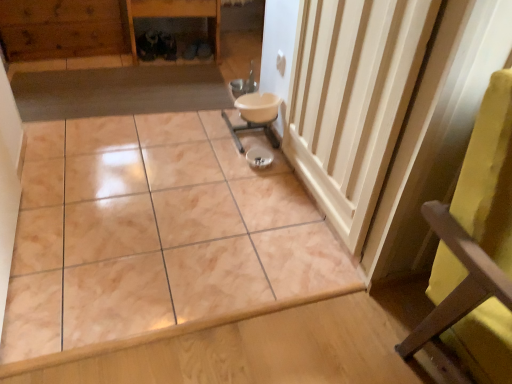
Find the location of a particular element. This screenshot has width=512, height=384. white glossy sink at center is located at coordinates click(254, 112).

The width and height of the screenshot is (512, 384). Describe the element at coordinates (63, 28) in the screenshot. I see `wooden cabinet at upper left` at that location.

What is the approximate width of white wood radiator at center right?

3.07 inches.

This screenshot has width=512, height=384. Find the location of `marble tile at center`. marble tile at center is located at coordinates (154, 232).

The image size is (512, 384). Identify the location of white glossy sink at center. (254, 112).

Does wooden cabinet at upper left lie behind white glossy sink at center?

Yes, it is behind white glossy sink at center.

Is wooden cabinet at upper left positioned with its back to white glossy sink at center?

No, wooden cabinet at upper left's orientation is not away from white glossy sink at center.

I want to click on hardwood on the left of the white glossy sink at center, so click(63, 28).

From the image's perspective, is wooden cabinet at upper left on top of white glossy sink at center?

Indeed, from the image's perspective, wooden cabinet at upper left is shown above white glossy sink at center.

From a real-world perspective, is white glossy sink at center physically below marble tile at center?

No, from a real-world perspective, white glossy sink at center is not under marble tile at center.

How far apart are white glossy sink at center and marble tile at center?

white glossy sink at center is 24.47 inches from marble tile at center.

Is white glossy sink at center facing towards marble tile at center?

Yes, white glossy sink at center is facing marble tile at center.

In order to click on sink behind the marble tile at center in this screenshot , I will do `click(254, 112)`.

What's the angular difference between white wood radiator at center right and white glossy sink at center's facing directions?

white wood radiator at center right and white glossy sink at center are facing 0.339 degrees away from each other.

From the picture: Considering the positions of objects white wood radiator at center right and white glossy sink at center in the image provided, who is in front, white wood radiator at center right or white glossy sink at center?

white wood radiator at center right is in front.

Where is `radiator in front of the white glossy sink at center`? radiator in front of the white glossy sink at center is located at coordinates (352, 100).

Would you consider white wood radiator at center right to be distant from white glossy sink at center?

white wood radiator at center right is actually quite close to white glossy sink at center.

Between wooden cabinet at upper left and white wood radiator at center right, which one has smaller width?

white wood radiator at center right is thinner.

Does wooden cabinet at upper left have a greater height compared to white wood radiator at center right?

In fact, wooden cabinet at upper left may be shorter than white wood radiator at center right.

Is white wood radiator at center right inside wooden cabinet at upper left?

No, white wood radiator at center right is located outside of wooden cabinet at upper left.

From the image's perspective, does white glossy sink at center appear higher than wooden cabinet at upper left?

No, from the image's perspective, white glossy sink at center is not on top of wooden cabinet at upper left.

Is white glossy sink at center further to the viewer compared to wooden cabinet at upper left?

No, the depth of white glossy sink at center is less than that of wooden cabinet at upper left.

Is wooden cabinet at upper left inside white glossy sink at center?

Definitely not — wooden cabinet at upper left is not inside white glossy sink at center.

Considering the sizes of white glossy sink at center and wooden cabinet at upper left in the image, is white glossy sink at center wider or thinner than wooden cabinet at upper left?

In the image, white glossy sink at center appears to be more narrow than wooden cabinet at upper left.

Can we say white glossy sink at center lies outside white wood radiator at center right?

white glossy sink at center lies outside white wood radiator at center right's area.

Considering the relative positions of white glossy sink at center and white wood radiator at center right in the image provided, is white glossy sink at center to the left of white wood radiator at center right from the viewer's perspective?

Yes.

Who is taller, white glossy sink at center or white wood radiator at center right?

Standing taller between the two is white wood radiator at center right.

From a real-world perspective, does white glossy sink at center stand above white wood radiator at center right?

No, from a real-world perspective, white glossy sink at center is not above white wood radiator at center right.

Is white wood radiator at center right inside the boundaries of marble tile at center, or outside?

white wood radiator at center right lies outside marble tile at center.

Is point (366, 127) positioned in front of point (188, 145)?

Yes, it is in front of point (188, 145).

In order to click on ceramic tile that appears above the white wood radiator at center right (from the image's perspective) in this screenshot , I will do point(154,232).

Who is bigger, white wood radiator at center right or marble tile at center?

marble tile at center is bigger.

In order to click on sink in front of the wooden cabinet at upper left in this screenshot , I will do `click(254, 112)`.

Locate an element on the screen. sink to the right of marble tile at center is located at coordinates 254,112.

Looking at the image, which one is located closer to white wood radiator at center right, marble tile at center or wooden cabinet at upper left?

marble tile at center is closer to white wood radiator at center right.

Based on the photo, which object lies nearer to the anchor point wooden cabinet at upper left, white glossy sink at center or marble tile at center?

Based on the image, white glossy sink at center appears to be nearer to wooden cabinet at upper left.

From the image, which object appears to be nearer to white wood radiator at center right, wooden cabinet at upper left or marble tile at center?

Based on the image, marble tile at center appears to be nearer to white wood radiator at center right.

Based on their spatial positions, is white glossy sink at center or marble tile at center further from white wood radiator at center right?

white glossy sink at center is positioned further to the anchor white wood radiator at center right.

From the image, which object appears to be farther from white wood radiator at center right, white glossy sink at center or wooden cabinet at upper left?

wooden cabinet at upper left lies further to white wood radiator at center right than the other object.

Based on the photo, estimate the real-world distances between objects in this image. Which object is further from marble tile at center, white wood radiator at center right or wooden cabinet at upper left?

wooden cabinet at upper left lies further to marble tile at center than the other object.

Which object lies further to the anchor point white glossy sink at center, marble tile at center or wooden cabinet at upper left?

wooden cabinet at upper left is further to white glossy sink at center.

Which object lies nearer to the anchor point marble tile at center, white glossy sink at center or wooden cabinet at upper left?

The object closer to marble tile at center is white glossy sink at center.

This screenshot has width=512, height=384. What are the coordinates of `sink between wooden cabinet at upper left and white wood radiator at center right in the horizontal direction` in the screenshot? It's located at (254, 112).

Identify the location of ceramic tile between white wood radiator at center right and white glossy sink at center along the z-axis. The width and height of the screenshot is (512, 384). (154, 232).

The width and height of the screenshot is (512, 384). Find the location of `sink between marble tile at center and wooden cabinet at upper left in the front-back direction`. sink between marble tile at center and wooden cabinet at upper left in the front-back direction is located at coordinates (254, 112).

This screenshot has width=512, height=384. In order to click on ceramic tile between white wood radiator at center right and wooden cabinet at upper left in the front-back direction in this screenshot , I will do `click(154, 232)`.